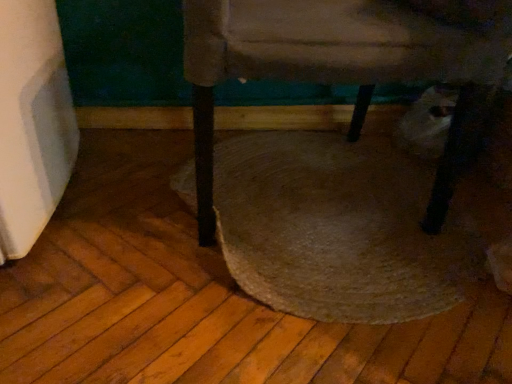
Question: Could you tell me if velvet beige chair at center is turned towards rug at center?

Choices:
 (A) yes
 (B) no

Answer: (B)

Question: Is velvet beige chair at center facing away from rug at center?

Choices:
 (A) yes
 (B) no

Answer: (B)

Question: Is velvet beige chair at center beside rug at center?

Choices:
 (A) no
 (B) yes

Answer: (A)

Question: Considering the relative sizes of velvet beige chair at center and rug at center in the image provided, is velvet beige chair at center taller than rug at center?

Choices:
 (A) yes
 (B) no

Answer: (A)

Question: Considering the relative sizes of velvet beige chair at center and rug at center in the image provided, is velvet beige chair at center thinner than rug at center?

Choices:
 (A) no
 (B) yes

Answer: (B)

Question: Would you consider velvet beige chair at center to be distant from rug at center?

Choices:
 (A) yes
 (B) no

Answer: (B)

Question: Is rug at center smaller than velvet beige chair at center?

Choices:
 (A) yes
 (B) no

Answer: (A)

Question: Is rug at center far away from velvet beige chair at center?

Choices:
 (A) no
 (B) yes

Answer: (A)

Question: Is rug at center facing towards velvet beige chair at center?

Choices:
 (A) no
 (B) yes

Answer: (B)

Question: Can you confirm if rug at center is positioned to the left of velvet beige chair at center?

Choices:
 (A) yes
 (B) no

Answer: (B)

Question: Is the position of rug at center less distant than that of velvet beige chair at center?

Choices:
 (A) no
 (B) yes

Answer: (A)

Question: Considering the relative sizes of rug at center and velvet beige chair at center in the image provided, is rug at center shorter than velvet beige chair at center?

Choices:
 (A) yes
 (B) no

Answer: (A)

Question: Considering the positions of velvet beige chair at center and rug at center in the image, is velvet beige chair at center bigger or smaller than rug at center?

Choices:
 (A) small
 (B) big

Answer: (B)